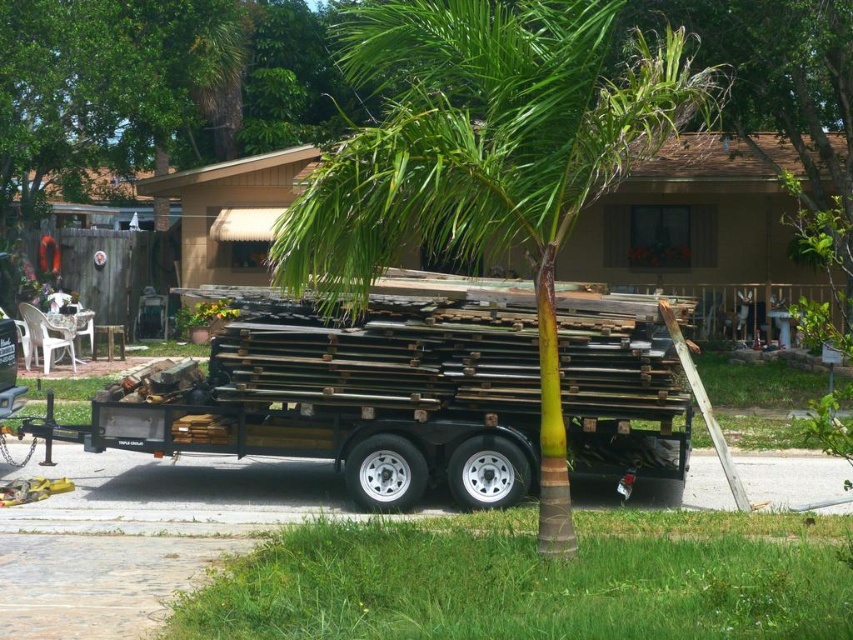
Question: Is wooden planks at center positioned behind green leafy palm tree at center?

Choices:
 (A) no
 (B) yes

Answer: (B)

Question: Does wooden planks at center come behind green leafy palm tree at center?

Choices:
 (A) yes
 (B) no

Answer: (A)

Question: Which point is closer to the camera?

Choices:
 (A) (102, 422)
 (B) (357, 225)

Answer: (B)

Question: Which point is farther to the camera?

Choices:
 (A) (418, 362)
 (B) (485, 17)

Answer: (A)

Question: Is wooden planks at center wider than green leafy palm tree at center?

Choices:
 (A) yes
 (B) no

Answer: (B)